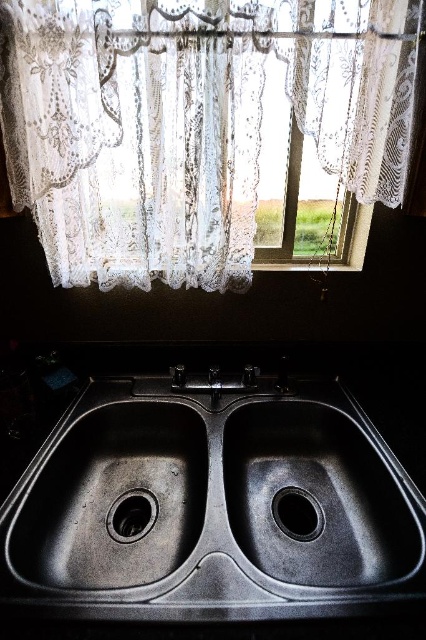
You are a window cleaner standing in front of the kitchen sink area. You need to clean the white lace curtain at upper center and the black rubber drain at center. Which object is located to the right of the other?

The white lace curtain at upper center is positioned on the right side of black rubber drain at center.

You are a window cleaner who needs to clean the window behind the white lace curtain at upper center. The black matte sink at center is directly below it. Since the sink is in the way, can you reach the curtain to clean the window?

The white lace curtain at upper center is wider than the black matte sink at center, so you can reach around the sink to clean the window behind the white lace curtain at upper center.

You are standing in the kitchen sink area and need to locate the point at coordinates point (189, 124). Based on the scene description, where exactly is this point located?

The point (189, 124) is located on the white lace curtain at upper center.